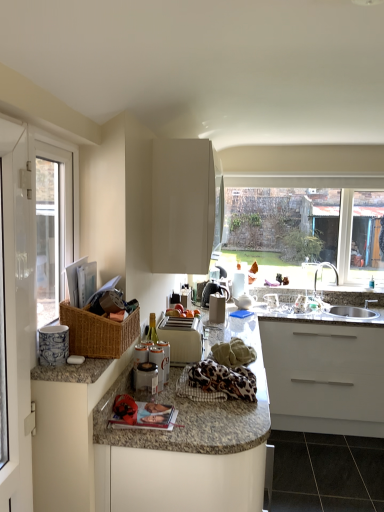
The width and height of the screenshot is (384, 512). What are the coordinates of `white plastic toaster at center, positioned as the 3th appliance in left-to-right order` in the screenshot? It's located at click(x=182, y=338).

In order to click on granite at lower right in this screenshot , I will do `click(327, 473)`.

What do you see at coordinates (321, 270) in the screenshot? I see `silver metallic faucet at right` at bounding box center [321, 270].

What are the coordinates of `silver metallic faucet at right` in the screenshot? It's located at (321, 270).

In order to face metallic silver cans at center, the second appliance from the left, should I rotate leftwards or rightwards?

A 4.967 degree turn to the left will do.

What do you see at coordinates (304, 305) in the screenshot? I see `white plastic dish rack at center, the first appliance viewed from the right` at bounding box center [304, 305].

Where is `blue and white ceramic mug at left, which is the 5th appliance from back to front`? blue and white ceramic mug at left, which is the 5th appliance from back to front is located at coordinates (53, 345).

At what (x,y) coordinates should I click in order to perform the action: click on white plastic toaster at center, marked as the 3th appliance in a right-to-left arrangement. Please return your answer as a coordinate pair (x, y). This screenshot has height=512, width=384. Looking at the image, I should click on (182, 338).

Is point (193, 398) closer or farther from the camera than point (282, 466)?

Clearly, point (193, 398) is closer to the camera than point (282, 466).

Which object is further away from the camera taking this photo, leopard print fabric at center or granite at lower right?

granite at lower right is behind.

Would you say leopard print fabric at center is outside granite at lower right?

Yes, leopard print fabric at center is outside of granite at lower right.

From the image's perspective, who appears lower, leopard print fabric at center or granite at lower right?

granite at lower right.

Is granite at lower right far from granite countertop at center, the 2th cabinetry positioned from the top?

Yes, granite at lower right is far from granite countertop at center, the 2th cabinetry positioned from the top.

Based on the photo, can you confirm if granite at lower right is taller than granite countertop at center, the 2th cabinetry positioned from the top?

Incorrect, the height of granite at lower right is not larger of that of granite countertop at center, the 2th cabinetry positioned from the top.

Based on the photo, which is farther, (327,460) or (106,505)?

The point (327,460) is more distant.

Is granite at lower right wider than granite countertop at center, the 2th cabinetry positioned from the top?

Correct, the width of granite at lower right exceeds that of granite countertop at center, the 2th cabinetry positioned from the top.

Where is `the 1st appliance behind when counting from the blue and white ceramic mug at left, which is the 5th appliance from back to front`? Image resolution: width=384 pixels, height=512 pixels. the 1st appliance behind when counting from the blue and white ceramic mug at left, which is the 5th appliance from back to front is located at coordinates (164, 355).

Can you confirm if metallic silver cans at center, placed as the fourth appliance when sorted from back to front, is thinner than blue and white ceramic mug at left, which is the 5th appliance from back to front?

No, metallic silver cans at center, placed as the fourth appliance when sorted from back to front, is not thinner than blue and white ceramic mug at left, which is the 5th appliance from back to front.

Between metallic silver cans at center, placed as the 4th appliance when sorted from right to left, and blue and white ceramic mug at left, acting as the first appliance starting from the front, which one appears on the right side from the viewer's perspective?

Positioned to the right is metallic silver cans at center, placed as the 4th appliance when sorted from right to left.

Between metallic silver cans at center, arranged as the second appliance when viewed from the front, and blue and white ceramic mug at left, which appears as the first appliance when viewed from the left, which one has smaller size?

With smaller size is blue and white ceramic mug at left, which appears as the first appliance when viewed from the left.

Is there a large distance between white glossy screen door at left and metallic silver cans at center, the second appliance from the left?

No, white glossy screen door at left is in close proximity to metallic silver cans at center, the second appliance from the left.

Is point (29, 320) behind point (169, 361)?

No, it is not.

Can you confirm if white glossy screen door at left is wider than metallic silver cans at center, placed as the 4th appliance when sorted from right to left?

No.

This screenshot has height=512, width=384. Identify the location of screen door in front of the metallic silver cans at center, placed as the 4th appliance when sorted from right to left. (17, 314).

Would you say satin silver sink at lower right contains silver metallic faucet at right?

Actually, silver metallic faucet at right is outside satin silver sink at lower right.

Is satin silver sink at lower right positioned far away from silver metallic faucet at right?

satin silver sink at lower right is near silver metallic faucet at right, not far away.

Is satin silver sink at lower right wider or thinner than silver metallic faucet at right?

satin silver sink at lower right is wider than silver metallic faucet at right.

Which is closer to the camera, (359, 315) or (338, 275)?

Point (359, 315) appears to be closer to the viewer than point (338, 275).

In the image, is silver metallic faucet at right on the left side or the right side of leopard print fabric at center?

Based on their positions, silver metallic faucet at right is located to the right of leopard print fabric at center.

Is leopard print fabric at center at the back of silver metallic faucet at right?

silver metallic faucet at right is not turned away from leopard print fabric at center.

Is silver metallic faucet at right closer to camera compared to leopard print fabric at center?

That is False.

Does silver metallic faucet at right have a lesser width compared to leopard print fabric at center?

Yes.

Relative to satin silver sink at lower right, is white plastic dish rack at center, positioned as the 5th appliance in front-to-back order, in front or behind?

Clearly, white plastic dish rack at center, positioned as the 5th appliance in front-to-back order, is behind satin silver sink at lower right.

Looking at the image, does white plastic dish rack at center, the first appliance viewed from the right, seem bigger or smaller compared to satin silver sink at lower right?

Clearly, white plastic dish rack at center, the first appliance viewed from the right, is smaller in size than satin silver sink at lower right.

Considering the relative sizes of white plastic dish rack at center, the first appliance viewed from the right, and satin silver sink at lower right in the image provided, is white plastic dish rack at center, the first appliance viewed from the right, shorter than satin silver sink at lower right?

Indeed, white plastic dish rack at center, the first appliance viewed from the right, has a lesser height compared to satin silver sink at lower right.

Would you consider white plastic dish rack at center, positioned as the 5th appliance in front-to-back order, to be distant from satin silver sink at lower right?

No, white plastic dish rack at center, positioned as the 5th appliance in front-to-back order, is not far away from satin silver sink at lower right.

At what (x,y) coordinates should I click in order to perform the action: click on material located above the granite at lower right (from a real-world perspective). Please return your answer as a coordinate pair (x, y). The width and height of the screenshot is (384, 512). Looking at the image, I should click on (217, 382).

From the granite at lower right, count the 1st cabinetry to the left and point to it. Please provide its 2D coordinates.

[(135, 454)]

Considering their positions, is leopard print fabric at center positioned further to granite countertop at center, the 2th cabinetry positioned from the top, than white plastic window frame at left?

The object further to granite countertop at center, the 2th cabinetry positioned from the top, is white plastic window frame at left.

When comparing their distances from white glossy cabinet at upper center, which appears as the second cabinetry when ordered from the bottom, does silver metallic faucet at right or satin silver sink at lower right seem closer?

A: satin silver sink at lower right is closer to white glossy cabinet at upper center, which appears as the second cabinetry when ordered from the bottom.

Estimate the real-world distances between objects in this image. Which object is closer to granite at lower right, white plastic dish rack at center, the first appliance viewed from the right, or satin silver sink at lower right?

satin silver sink at lower right.

Which object lies further to the anchor point white glossy screen door at left, white plastic dish rack at center, the first appliance viewed from the right, or granite at lower right?

The object further to white glossy screen door at left is white plastic dish rack at center, the first appliance viewed from the right.

Which object lies further to the anchor point leopard print fabric at center, white plastic toaster at center, marked as the third appliance in a back-to-front arrangement, or silver metallic faucet at right?

silver metallic faucet at right lies further to leopard print fabric at center than the other object.

From the image, which object appears to be nearer to granite countertop at center, the 2th cabinetry positioned from the top, granite at lower right or white glossy cabinet at upper center, which appears as the second cabinetry when ordered from the bottom?

white glossy cabinet at upper center, which appears as the second cabinetry when ordered from the bottom, lies closer to granite countertop at center, the 2th cabinetry positioned from the top, than the other object.

Estimate the real-world distances between objects in this image. Which object is further from leopard print fabric at center, granite countertop at center, the 2th cabinetry positioned from the top, or granite at lower right?

Based on the image, granite at lower right appears to be further to leopard print fabric at center.

Based on their spatial positions, is metallic silver cans at center, arranged as the second appliance when viewed from the front, or blue and white ceramic mug at left, which appears as the first appliance when viewed from the left, closer to white glossy cabinet at upper center, placed as the 1th cabinetry when sorted from top to bottom?

metallic silver cans at center, arranged as the second appliance when viewed from the front, is closer to white glossy cabinet at upper center, placed as the 1th cabinetry when sorted from top to bottom.

At what (x,y) coordinates should I click in order to perform the action: click on material between white glossy cabinet at upper center, placed as the 1th cabinetry when sorted from top to bottom, and granite at lower right vertically. Please return your answer as a coordinate pair (x, y). The image size is (384, 512). Looking at the image, I should click on (217, 382).

At what (x,y) coordinates should I click in order to perform the action: click on granite between white plastic window frame at left and silver metallic faucet at right from front to back. Please return your answer as a coordinate pair (x, y). Image resolution: width=384 pixels, height=512 pixels. Looking at the image, I should click on (327, 473).

This screenshot has width=384, height=512. I want to click on cabinetry positioned between leopard print fabric at center and white glossy toaster at center, which is the second appliance from right to left, from near to far, so click(186, 205).

Find the location of `granite between white plastic window frame at left and satin silver sink at lower right`. granite between white plastic window frame at left and satin silver sink at lower right is located at coordinates (327, 473).